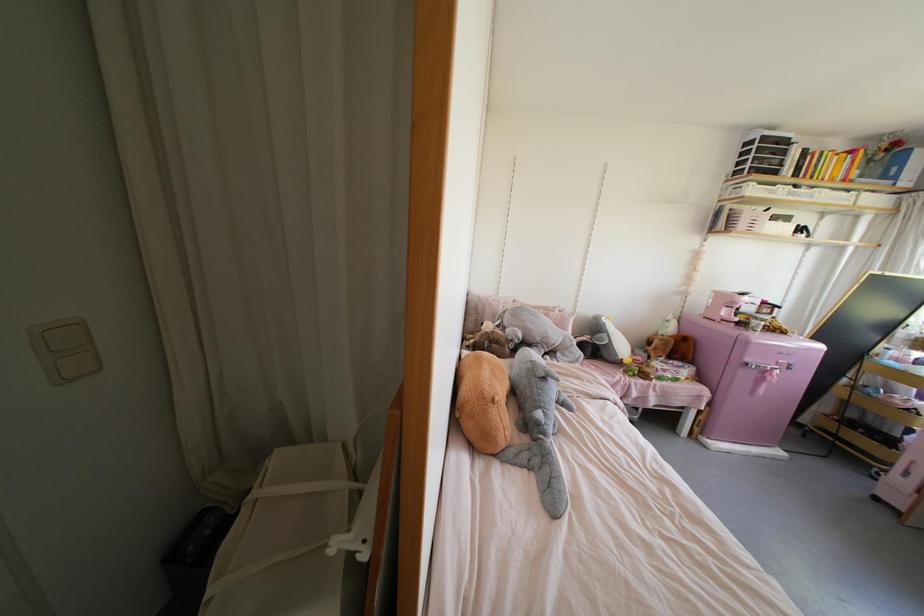
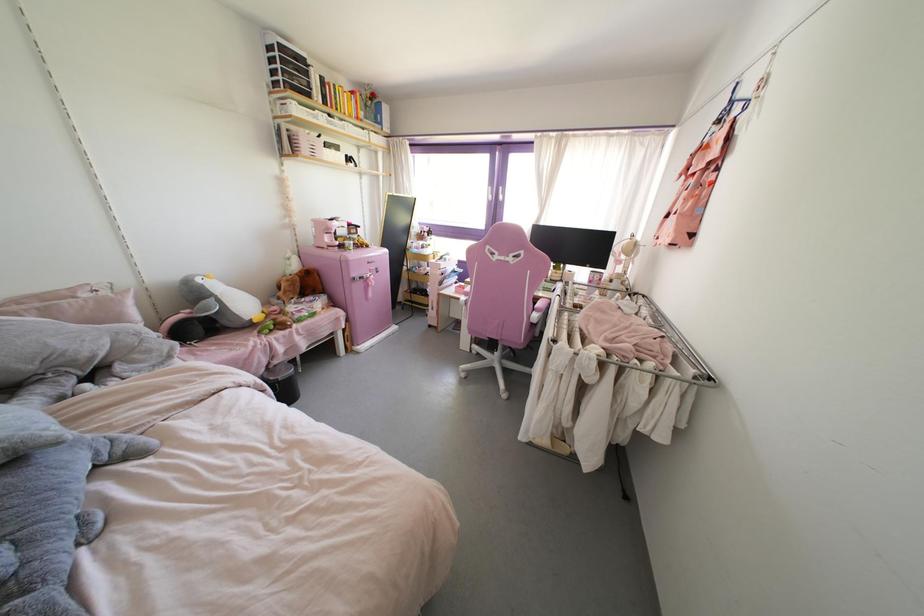
In the second image, find the point that corresponds to point (703, 446) in the first image.

(357, 352)